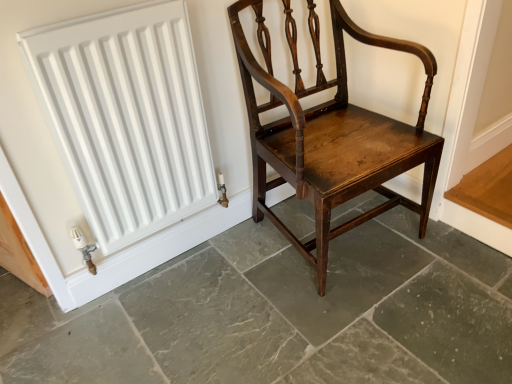
At what (x,y) coordinates should I click in order to perform the action: click on white matte radiator at upper left. Please return your answer as a coordinate pair (x, y). Looking at the image, I should click on (126, 117).

Describe the element at coordinates (331, 133) in the screenshot. I see `shiny dark wood chair at center` at that location.

Find the location of `white matte radiator at upper left`. white matte radiator at upper left is located at coordinates (126, 117).

How many degrees apart are the facing directions of dark brown wood chair at center and shiny dark wood chair at center?

dark brown wood chair at center and shiny dark wood chair at center are facing 86.8 degrees away from each other.

Is dark brown wood chair at center next to shiny dark wood chair at center and touching it?

dark brown wood chair at center and shiny dark wood chair at center are not in contact.

Which is behind, point (177, 278) or point (424, 163)?

Point (177, 278)

From the image's perspective, which object appears higher, dark brown wood chair at center or shiny dark wood chair at center?

shiny dark wood chair at center is shown above in the image.

From a real-world perspective, between dark brown wood chair at center and white matte radiator at upper left, who is vertically higher?

From a 3D spatial view, white matte radiator at upper left is above.

Based on the photo, which is closer to the camera, (318, 364) or (71, 166)?

Point (318, 364) is farther from the camera than point (71, 166).

What's the angular difference between dark brown wood chair at center and white matte radiator at upper left's facing directions?

The angular difference between dark brown wood chair at center and white matte radiator at upper left is 88.3 degrees.

From the image's perspective, which is below, dark brown wood chair at center or white matte radiator at upper left?

dark brown wood chair at center appears lower in the image.

Is white matte radiator at upper left situated inside shiny dark wood chair at center or outside?

white matte radiator at upper left is spatially situated outside shiny dark wood chair at center.

Is white matte radiator at upper left directly adjacent to shiny dark wood chair at center?

No, white matte radiator at upper left is not beside shiny dark wood chair at center.

Between white matte radiator at upper left and shiny dark wood chair at center, which one has less height?

white matte radiator at upper left is shorter.

Considering the relative sizes of white matte radiator at upper left and shiny dark wood chair at center in the image provided, is white matte radiator at upper left thinner than shiny dark wood chair at center?

Correct, the width of white matte radiator at upper left is less than that of shiny dark wood chair at center.

Is dark brown wood chair at center at the back of white matte radiator at upper left?

No, white matte radiator at upper left's orientation is not away from dark brown wood chair at center.

Does point (26, 39) lie behind point (70, 366)?

No, it is in front of (70, 366).

From a real-world perspective, which object stands above the other?

In real-world perspective, white matte radiator at upper left is above.

Image resolution: width=512 pixels, height=384 pixels. I want to click on radiator above the dark brown wood chair at center (from the image's perspective), so click(x=126, y=117).

Considering the sizes of shiny dark wood chair at center and white matte radiator at upper left in the image, is shiny dark wood chair at center wider or thinner than white matte radiator at upper left?

In the image, shiny dark wood chair at center appears to be wider than white matte radiator at upper left.

From their relative heights in the image, would you say shiny dark wood chair at center is taller or shorter than white matte radiator at upper left?

Clearly, shiny dark wood chair at center is taller compared to white matte radiator at upper left.

Is point (354, 33) positioned before point (133, 9)?

No.

Is shiny dark wood chair at center beside dark brown wood chair at center?

shiny dark wood chair at center and dark brown wood chair at center are not in contact.

Considering the points (310, 5) and (236, 320), which point is in front, point (310, 5) or point (236, 320)?

The point (236, 320) is closer.

Consider the image. Is shiny dark wood chair at center wider or thinner than dark brown wood chair at center?

shiny dark wood chair at center is thinner than dark brown wood chair at center.

At what (x,y) coordinates should I click in order to perform the action: click on concrete in front of the shiny dark wood chair at center. Please return your answer as a coordinate pair (x, y). This screenshot has height=384, width=512. Looking at the image, I should click on (280, 314).

This screenshot has height=384, width=512. Find the location of `chair on the right of the dark brown wood chair at center`. chair on the right of the dark brown wood chair at center is located at coordinates (331, 133).

The width and height of the screenshot is (512, 384). Find the location of `radiator on the left of the dark brown wood chair at center`. radiator on the left of the dark brown wood chair at center is located at coordinates (126, 117).

From the image, which object appears to be nearer to dark brown wood chair at center, white matte radiator at upper left or shiny dark wood chair at center?

shiny dark wood chair at center.

Which object lies further to the anchor point white matte radiator at upper left, shiny dark wood chair at center or dark brown wood chair at center?

Among the two, dark brown wood chair at center is located further to white matte radiator at upper left.

Looking at the image, which one is located closer to shiny dark wood chair at center, white matte radiator at upper left or dark brown wood chair at center?

dark brown wood chair at center is positioned closer to the anchor shiny dark wood chair at center.

From the image, which object appears to be nearer to shiny dark wood chair at center, dark brown wood chair at center or white matte radiator at upper left?

dark brown wood chair at center is positioned closer to the anchor shiny dark wood chair at center.

When comparing their distances from dark brown wood chair at center, does shiny dark wood chair at center or white matte radiator at upper left seem closer?

shiny dark wood chair at center lies closer to dark brown wood chair at center than the other object.

Estimate the real-world distances between objects in this image. Which object is further from white matte radiator at upper left, dark brown wood chair at center or shiny dark wood chair at center?

Based on the image, dark brown wood chair at center appears to be further to white matte radiator at upper left.

Image resolution: width=512 pixels, height=384 pixels. Find the location of `radiator between shiny dark wood chair at center and dark brown wood chair at center in the up-down direction`. radiator between shiny dark wood chair at center and dark brown wood chair at center in the up-down direction is located at coordinates (126, 117).